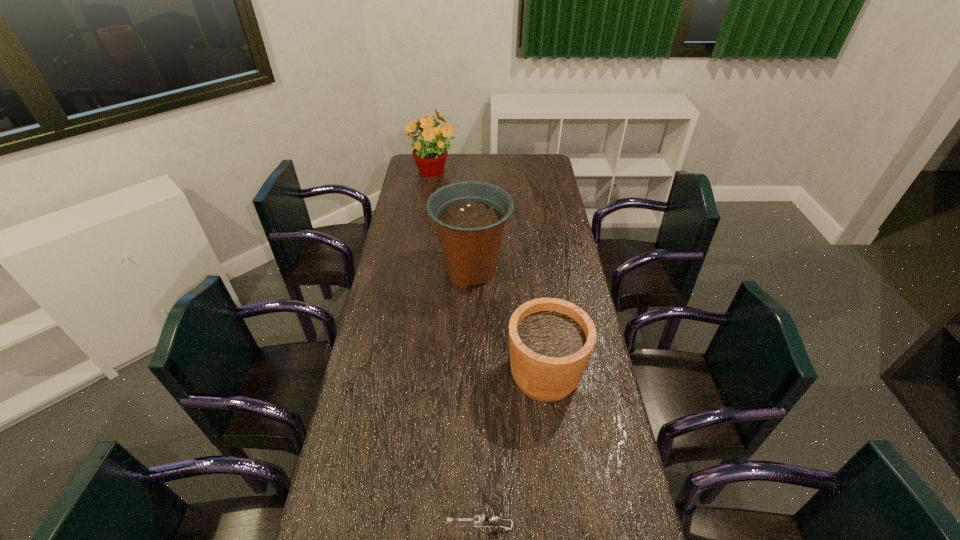
Where is `the farthest object`? Image resolution: width=960 pixels, height=540 pixels. the farthest object is located at coordinates coord(430,153).

At what (x,y) coordinates should I click in order to perform the action: click on the second farthest object. Please return your answer as a coordinate pair (x, y). The width and height of the screenshot is (960, 540). Looking at the image, I should click on (470, 216).

Locate an element on the screen. the second shortest object is located at coordinates (551, 340).

Where is `the third farthest object`? the third farthest object is located at coordinates (551, 340).

This screenshot has height=540, width=960. Find the location of `gun`. gun is located at coordinates (482, 520).

This screenshot has width=960, height=540. Identify the location of the nearest object. (482, 520).

You are a GUI agent. You are given a task and a screenshot of the screen. Output one action in this format:
    pyautogui.click(x=<x>, y=<y>)
    Task: Click on the vacant space located 0.330m on the front of the farthest flowerpot
    
    Given the screenshot: What is the action you would take?
    pyautogui.click(x=426, y=222)

Where is `vacant region located on the front of the second nearest flowerpot`? vacant region located on the front of the second nearest flowerpot is located at coordinates (470, 329).

Identify the location of vacant space situated on the left of the nearest flowerpot. This screenshot has width=960, height=540. (387, 375).

Where is `vacant space located 0.140m aimed along the barrel of the shortest object`? The height and width of the screenshot is (540, 960). vacant space located 0.140m aimed along the barrel of the shortest object is located at coordinates pos(393,526).